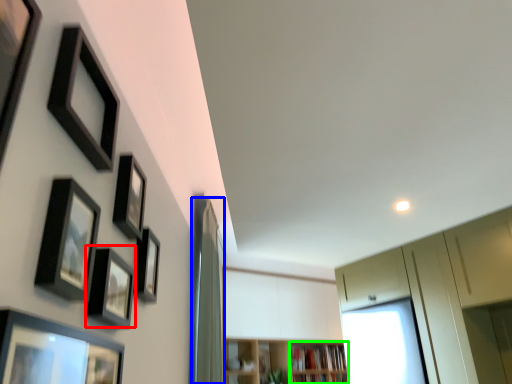
Question: Which is farther away from picture frame (highlighted by a red box)? curtain (highlighted by a blue box) or shelf (highlighted by a green box)?

Choices:
 (A) curtain
 (B) shelf

Answer: (B)